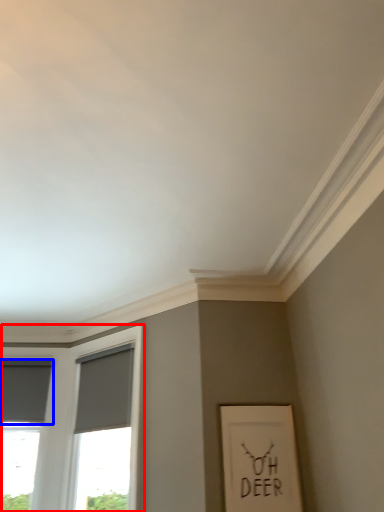
Question: Among these objects, which one is farthest to the camera, window (highlighted by a red box) or curtain (highlighted by a blue box)?

Choices:
 (A) window
 (B) curtain

Answer: (B)